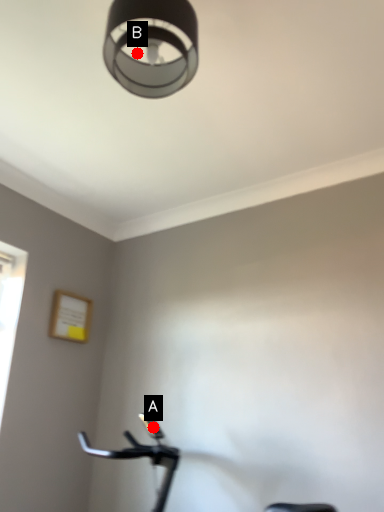
Question: Two points are circled on the image, labeled by A and B beside each circle. Which point is closer to the camera?

Choices:
 (A) A is closer
 (B) B is closer

Answer: (B)